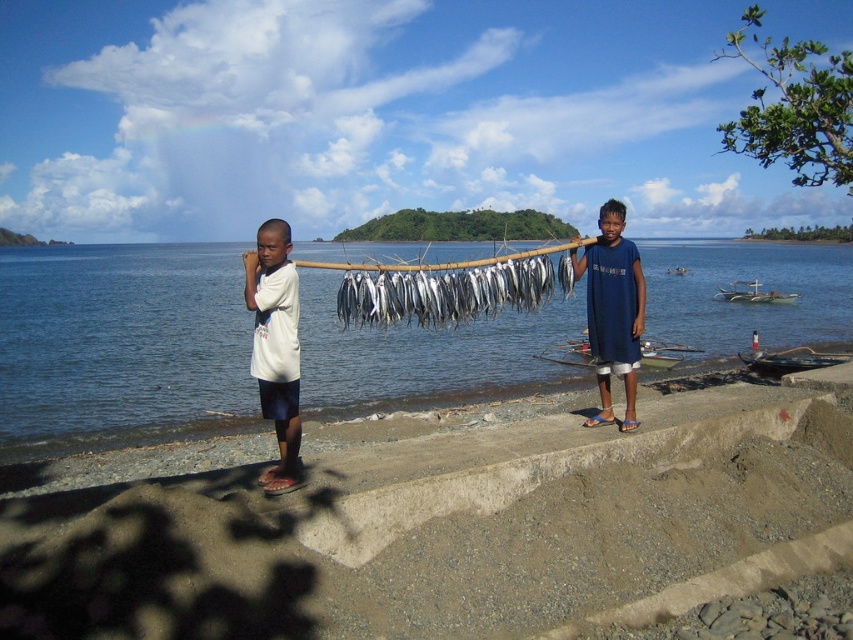
Question: Which of the following is the closest to the observer?

Choices:
 (A) (616, 353)
 (B) (280, 243)
 (C) (370, 289)

Answer: (B)

Question: Which point appears closest to the camera in this image?

Choices:
 (A) (598, 236)
 (B) (164, 262)
 (C) (560, 269)
 (D) (509, 301)

Answer: (D)

Question: Can you confirm if blue water at center is positioned to the left of silver metallic fish at center?

Choices:
 (A) yes
 (B) no

Answer: (B)

Question: Does blue water at center appear under blue cotton shirt at center?

Choices:
 (A) no
 (B) yes

Answer: (A)

Question: Can you confirm if blue water at center is thinner than silvery metallic fish at center?

Choices:
 (A) yes
 (B) no

Answer: (B)

Question: Among these points, which one is farthest from the camera?

Choices:
 (A) (461, 280)
 (B) (277, 268)
 (C) (630, 387)
 (D) (195, 348)

Answer: (D)